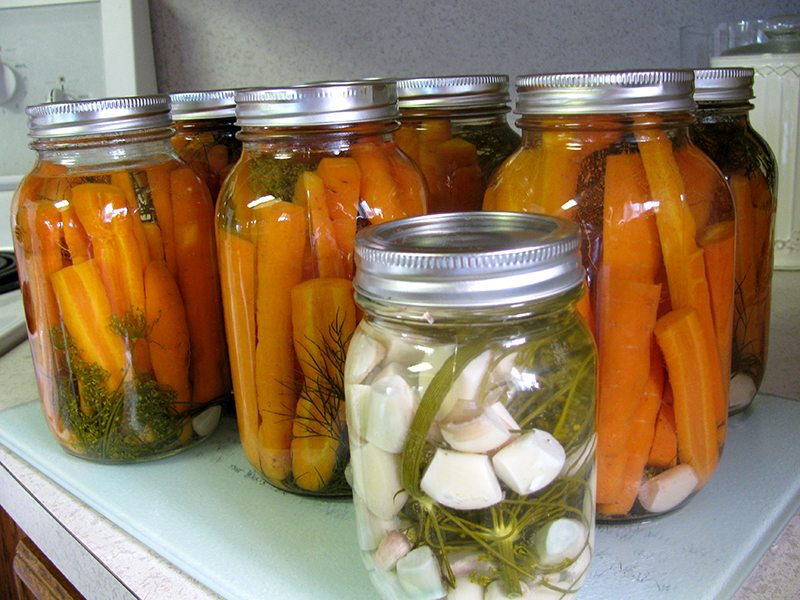
Where is `cutting board`? This screenshot has height=600, width=800. cutting board is located at coordinates (266, 518).